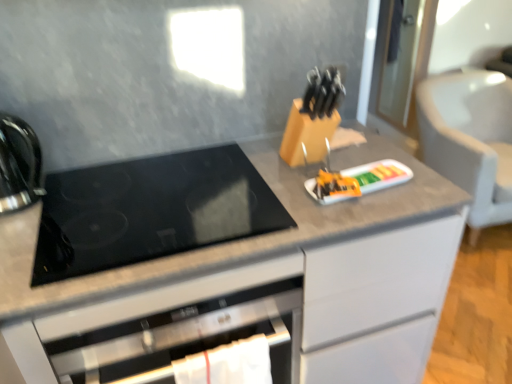
This screenshot has width=512, height=384. Identify the location of vacant area situated to the left side of orange plastic tray at center. (287, 182).